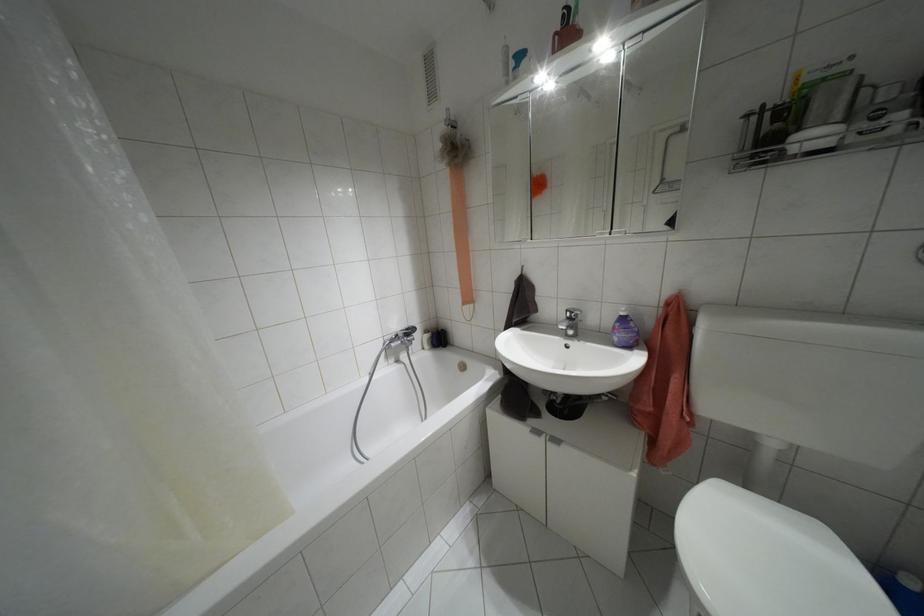
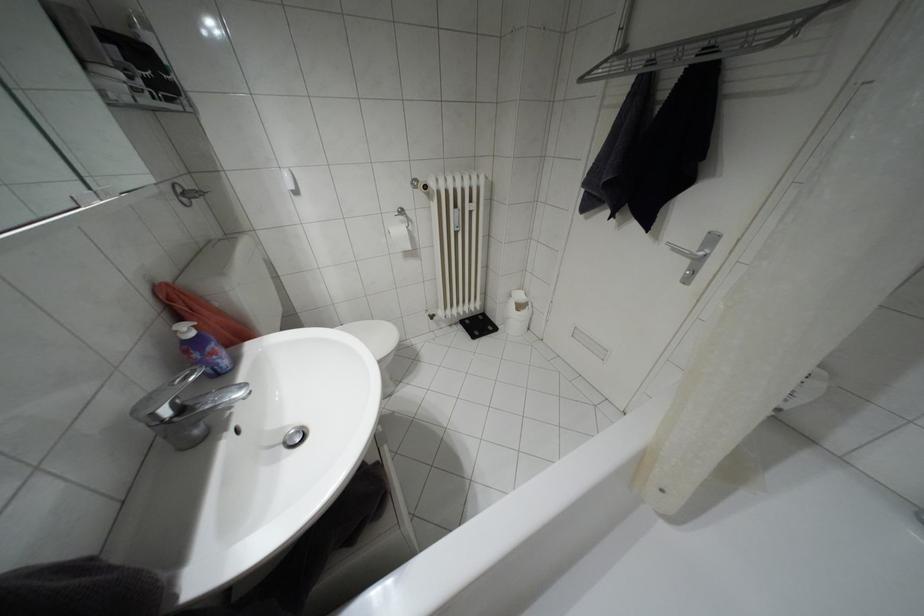
Where in the second image is the point corresponding to the point at 622,313 from the first image?

(190, 333)